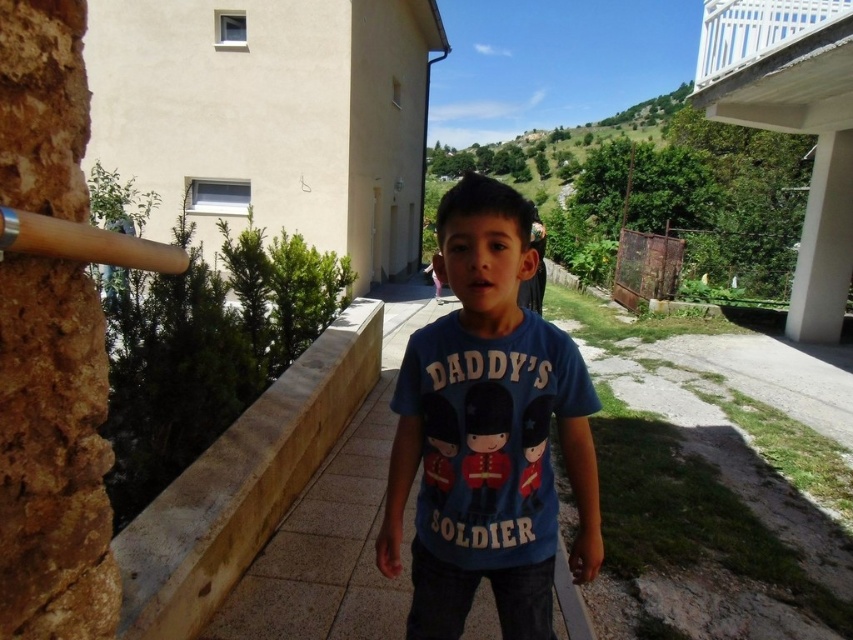
Between blue fabric shirt at center and wooden bat at left, which one is positioned lower?

blue fabric shirt at center

Does blue fabric shirt at center have a greater height compared to wooden bat at left?

No, blue fabric shirt at center is not taller than wooden bat at left.

Locate an element on the screen. This screenshot has height=640, width=853. blue fabric shirt at center is located at coordinates (337, 524).

Who is positioned more to the right, blue cotton shirt at center or blue fabric shirt at center?

blue cotton shirt at center

Is point (456, 358) positioned behind point (305, 499)?

No, (456, 358) is in front of (305, 499).

The image size is (853, 640). What are the coordinates of `blue cotton shirt at center` in the screenshot? It's located at (486, 433).

Between point (506, 301) and point (108, 248), which one is positioned behind?

Positioned behind is point (506, 301).

Between blue cotton shirt at center and wooden bat at left, which one is positioned lower?

blue cotton shirt at center is lower down.

Where is `blue cotton shirt at center`? blue cotton shirt at center is located at coordinates (486, 433).

You are a GUI agent. You are given a task and a screenshot of the screen. Output one action in this format:
    pyautogui.click(x=<x>, y=<y>)
    Task: Click on the blue cotton shirt at center
    The image size is (853, 640).
    Given the screenshot: What is the action you would take?
    pyautogui.click(x=486, y=433)